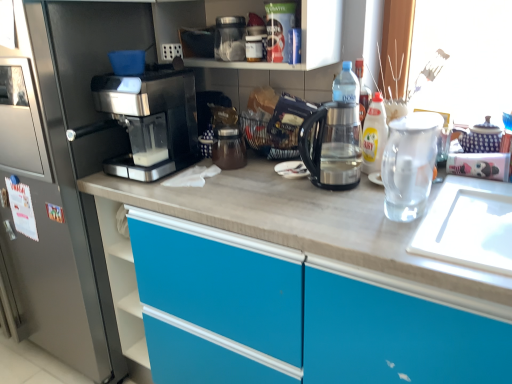
Question: Is the depth of sleek metallic coffee maker at left less than that of sleek black coffee machine at left?

Choices:
 (A) no
 (B) yes

Answer: (A)

Question: Does sleek metallic coffee maker at left have a smaller size compared to sleek black coffee machine at left?

Choices:
 (A) yes
 (B) no

Answer: (A)

Question: Considering the relative sizes of sleek metallic coffee maker at left and sleek black coffee machine at left in the image provided, is sleek metallic coffee maker at left shorter than sleek black coffee machine at left?

Choices:
 (A) yes
 (B) no

Answer: (A)

Question: Is sleek metallic coffee maker at left next to sleek black coffee machine at left?

Choices:
 (A) no
 (B) yes

Answer: (A)

Question: From the image's perspective, would you say sleek metallic coffee maker at left is shown under sleek black coffee machine at left?

Choices:
 (A) yes
 (B) no

Answer: (B)

Question: From a real-world perspective, is sleek metallic coffee maker at left positioned over sleek black coffee machine at left based on gravity?

Choices:
 (A) yes
 (B) no

Answer: (A)

Question: Considering the relative sizes of yellow glossy bottle at upper right and transparent glass tea pot at right in the image provided, is yellow glossy bottle at upper right shorter than transparent glass tea pot at right?

Choices:
 (A) no
 (B) yes

Answer: (B)

Question: Is yellow glossy bottle at upper right facing towards transparent glass tea pot at right?

Choices:
 (A) yes
 (B) no

Answer: (B)

Question: Is yellow glossy bottle at upper right closer to the viewer compared to transparent glass tea pot at right?

Choices:
 (A) no
 (B) yes

Answer: (A)

Question: From the image's perspective, would you say yellow glossy bottle at upper right is shown under transparent glass tea pot at right?

Choices:
 (A) yes
 (B) no

Answer: (B)

Question: Are yellow glossy bottle at upper right and transparent glass tea pot at right located far from each other?

Choices:
 (A) yes
 (B) no

Answer: (B)

Question: Is yellow glossy bottle at upper right positioned behind transparent glass tea pot at right?

Choices:
 (A) yes
 (B) no

Answer: (A)

Question: Is yellow glossy bottle at upper right touching transparent plastic kettle at center?

Choices:
 (A) no
 (B) yes

Answer: (A)